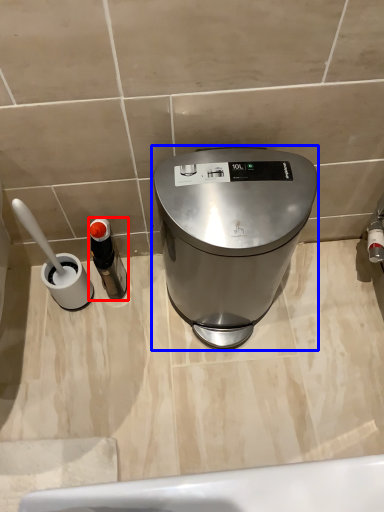
Question: Among these objects, which one is farthest to the camera, bottle (highlighted by a red box) or waste container (highlighted by a blue box)?

Choices:
 (A) bottle
 (B) waste container

Answer: (A)